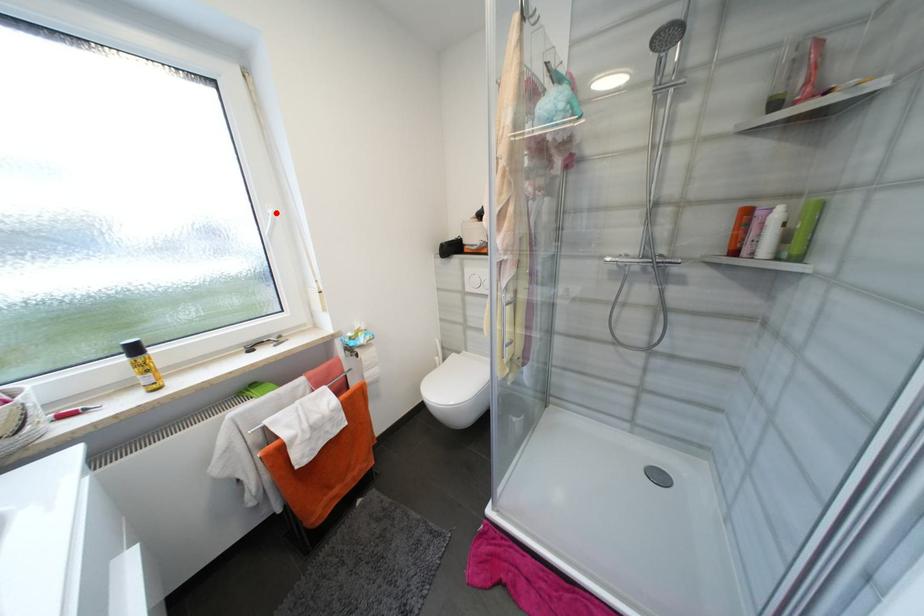
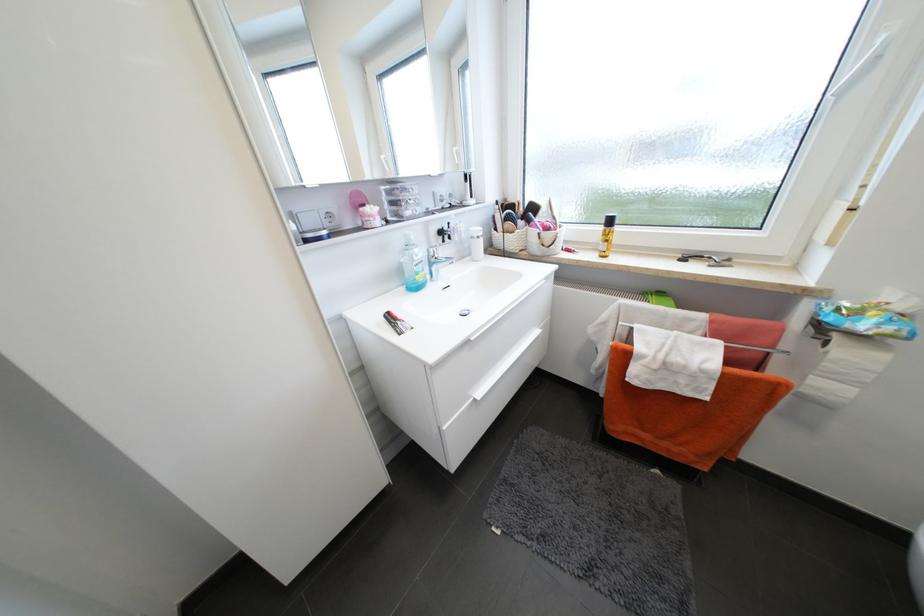
Question: I am providing you with two images of the same scene from different viewpoints. A red point is marked on the first image. Can you still see the location of the red point in image 2?

Choices:
 (A) Yes
 (B) No

Answer: (A)